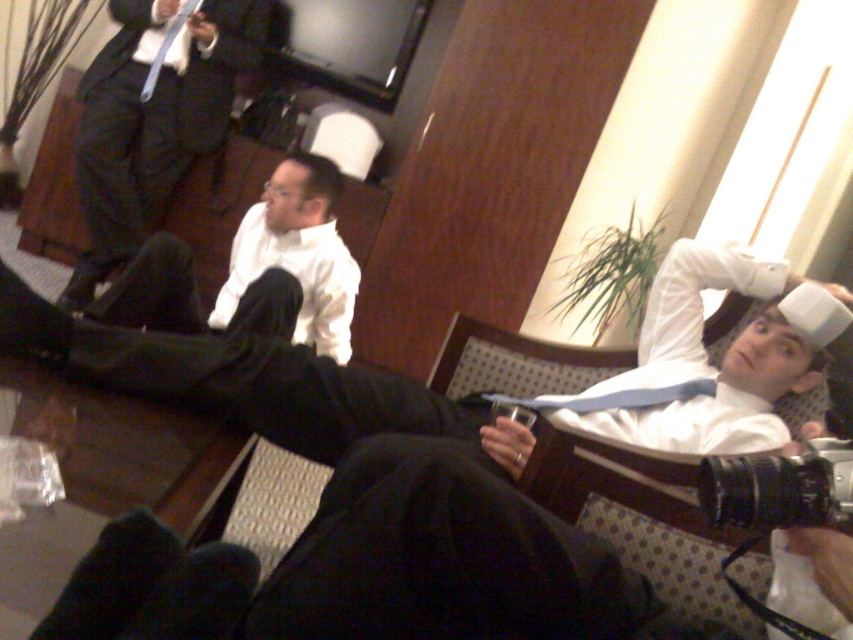
You are an interior designer planning to place a new sofa in the lounge. The sofa you have chosen is 1.5 meters wide. The current space available for the sofa is between the matte black suit at upper left and the nearest wall. According to the scene description, can the sofa fit in that space?

The position of matte black suit at upper left is at point (155,113). However, without knowing the distance to the nearest wall or the available space width, it is impossible to determine if the sofa will fit. More information is needed.

You are standing in the lounge and want to place a small plant between the two points, point (148, 106) and point (302, 236). Which point should the plant be closer to in order to be between them?

The plant should be closer to point (302, 236) because point (148, 106) is behind point (302, 236).

You are a photographer setting up for a group photo. You have a camera with a focal length of 50mm. The minimum focusing distance of your camera is 34 inches. You need to ensure that both the matte black suit at upper left and the white matte shirt at center are in focus. Can you position yourself so that both are within the minimum focusing distance?

The distance between the matte black suit at upper left and the white matte shirt at center is 34.30 inches. Since the minimum focusing distance is 34 inches, the photographer needs to be closer than 34 inches to both subjects. However, the total distance between them exceeds this, so positioning within the minimum focusing distance for both might not be possible. Alternatively, adjusting the camera settings or using a different lens could help achieve focus on both.